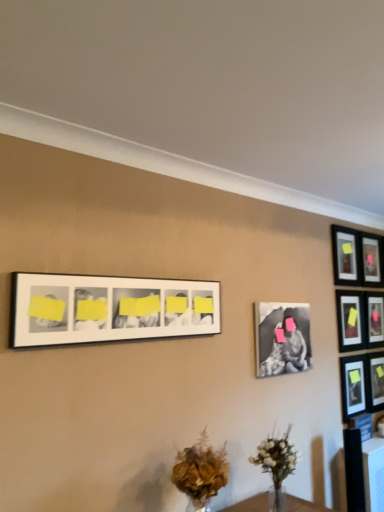
Question: Is brown textured bouquet at lower center turned away from matte black picture frame at upper right, the 6th picture frame when ordered from left to right?

Choices:
 (A) no
 (B) yes

Answer: (A)

Question: Is brown textured bouquet at lower center in front of matte black picture frame at upper right, which ranks as the third picture frame in right-to-left order?

Choices:
 (A) yes
 (B) no

Answer: (A)

Question: From a real-world perspective, is brown textured bouquet at lower center located higher than matte black picture frame at upper right, which ranks as the third picture frame in right-to-left order?

Choices:
 (A) yes
 (B) no

Answer: (B)

Question: Is brown textured bouquet at lower center next to matte black picture frame at upper right, the 6th picture frame when ordered from left to right?

Choices:
 (A) yes
 (B) no

Answer: (B)

Question: Can you confirm if brown textured bouquet at lower center is smaller than matte black picture frame at upper right, which ranks as the third picture frame in right-to-left order?

Choices:
 (A) no
 (B) yes

Answer: (A)

Question: Considering the relative positions of black matte photo frame at center-right, the 7th picture frame when ordered from right to left, and matte black picture frame at upper right, the 6th picture frame when ordered from left to right, in the image provided, is black matte photo frame at center-right, the 7th picture frame when ordered from right to left, to the left or to the right of matte black picture frame at upper right, the 6th picture frame when ordered from left to right,?

Choices:
 (A) left
 (B) right

Answer: (A)

Question: Is black matte photo frame at center-right, the 7th picture frame when ordered from right to left, bigger or smaller than matte black picture frame at upper right, which ranks as the third picture frame in right-to-left order?

Choices:
 (A) big
 (B) small

Answer: (A)

Question: In terms of height, does black matte photo frame at center-right, which ranks as the second picture frame in left-to-right order, look taller or shorter compared to matte black picture frame at upper right, which ranks as the third picture frame in right-to-left order?

Choices:
 (A) tall
 (B) short

Answer: (B)

Question: From the image's perspective, relative to matte black picture frame at upper right, which ranks as the third picture frame in right-to-left order, is black matte photo frame at center-right, the 7th picture frame when ordered from right to left, above or below?

Choices:
 (A) below
 (B) above

Answer: (A)

Question: Considering the positions of white matte picture frame at upper center, which is the 1th picture frame in left-to-right order, and pink matte picture frame at upper right, which is counted as the seventh picture frame, starting from the left, in the image, is white matte picture frame at upper center, which is the 1th picture frame in left-to-right order, bigger or smaller than pink matte picture frame at upper right, which is counted as the seventh picture frame, starting from the left,?

Choices:
 (A) big
 (B) small

Answer: (A)

Question: In the image, is white matte picture frame at upper center, the 8th picture frame viewed from the right, positioned in front of or behind pink matte picture frame at upper right, which is counted as the seventh picture frame, starting from the left?

Choices:
 (A) front
 (B) behind

Answer: (A)

Question: From a real-world perspective, is white matte picture frame at upper center, the 8th picture frame viewed from the right, physically located above or below pink matte picture frame at upper right, the second picture frame positioned from the right?

Choices:
 (A) below
 (B) above

Answer: (B)

Question: Is white matte picture frame at upper center, the 8th picture frame viewed from the right, situated inside pink matte picture frame at upper right, the second picture frame positioned from the right, or outside?

Choices:
 (A) inside
 (B) outside

Answer: (B)

Question: Is white matte vase at lower center wider or thinner than pink matte picture frame at upper right, the second picture frame positioned from the right?

Choices:
 (A) thin
 (B) wide

Answer: (B)

Question: From a real-world perspective, relative to pink matte picture frame at upper right, which is counted as the seventh picture frame, starting from the left, is white matte vase at lower center vertically above or below?

Choices:
 (A) below
 (B) above

Answer: (A)